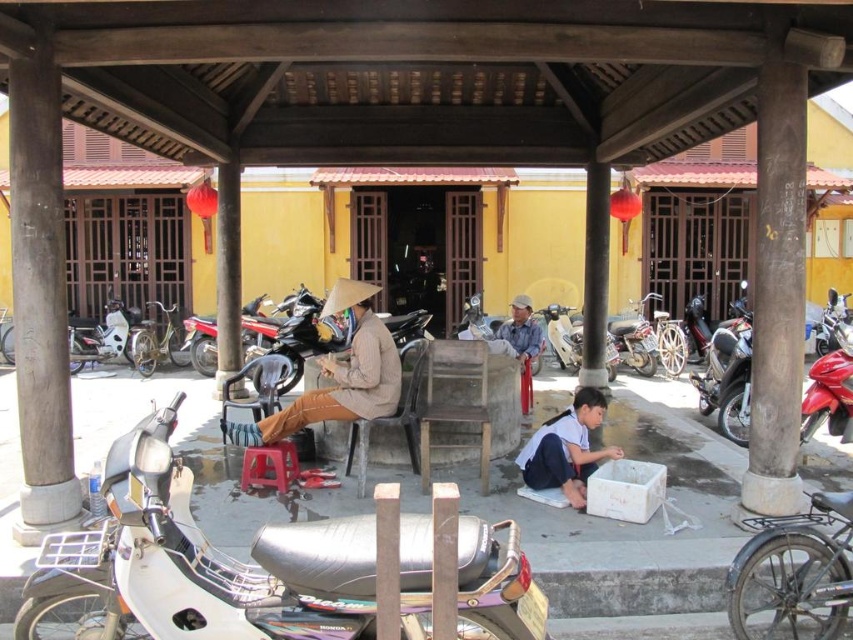
Question: Can you confirm if white matte motorcycle at left is bigger than metallic silver scooter at center?

Choices:
 (A) no
 (B) yes

Answer: (B)

Question: Based on their relative distances, which object is farther from the white matte motorcycle at left?

Choices:
 (A) silver metallic motorcycle at lower left
 (B) red plastic stool at center

Answer: (A)

Question: Does shiny chrome motorcycle at lower right have a larger size compared to brown matte conical hat at center?

Choices:
 (A) yes
 (B) no

Answer: (B)

Question: Which point appears farthest from the camera in this image?

Choices:
 (A) (462, 545)
 (B) (573, 356)

Answer: (B)

Question: Estimate the real-world distances between objects in this image. Which object is closer to the red plastic stool at center?

Choices:
 (A) metallic silver scooter at center
 (B) brown matte conical hat at center
 (C) silver metallic motorcycle at lower left

Answer: (B)

Question: Does shiny chrome motorcycle at lower right lie in front of brown matte conical hat at center?

Choices:
 (A) yes
 (B) no

Answer: (A)